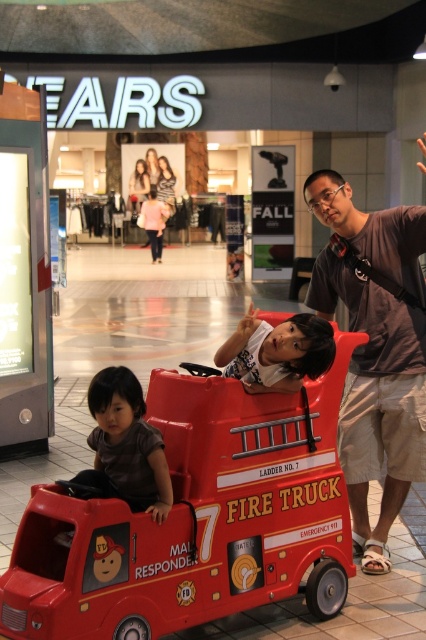
Does shiny plastic fire truck at center have a greater height compared to matte gray shirt at center?

No.

Which is behind, point (327, 515) or point (422, 465)?

Point (422, 465)

Between point (287, 460) and point (385, 316), which one is positioned in front?

Point (287, 460) is more forward.

The width and height of the screenshot is (426, 640). I want to click on shiny plastic fire truck at center, so 195,518.

Is matte gray shirt at center positioned before matte brown shirt at lower left?

No, matte gray shirt at center is behind matte brown shirt at lower left.

Is matte gray shirt at center to the right of matte brown shirt at lower left from the viewer's perspective?

Indeed, matte gray shirt at center is positioned on the right side of matte brown shirt at lower left.

Between point (408, 461) and point (115, 472), which one is positioned behind?

The point (408, 461) is more distant.

Where is `matte gray shirt at center`? This screenshot has height=640, width=426. matte gray shirt at center is located at coordinates (374, 349).

Between shiny plastic fire truck at center and smooth white shirt at center, which one appears on the right side from the viewer's perspective?

smooth white shirt at center

Which is in front, point (141, 612) or point (264, 333)?

Point (141, 612) is more forward.

The image size is (426, 640). I want to click on shiny plastic fire truck at center, so click(195, 518).